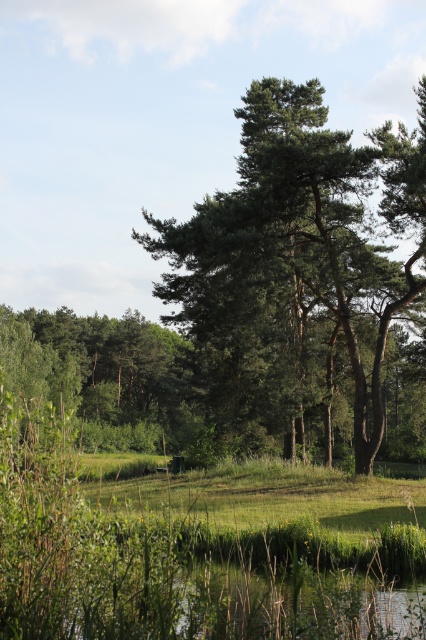
Question: Does green leafy tree at center appear on the left side of green leafy tree at left?

Choices:
 (A) no
 (B) yes

Answer: (A)

Question: Is green leafy tree at center positioned behind green leafy tree at left?

Choices:
 (A) no
 (B) yes

Answer: (A)

Question: Is green leafy tree at center positioned in front of green leafy tree at left?

Choices:
 (A) no
 (B) yes

Answer: (B)

Question: Which point is closer to the camera?

Choices:
 (A) green leafy tree at center
 (B) green leafy tree at left

Answer: (A)